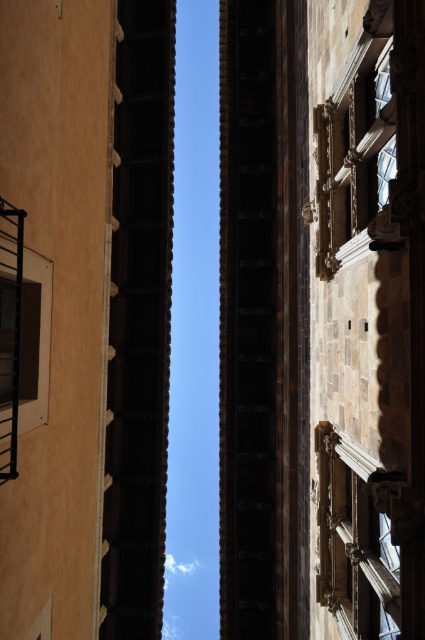
Is polished stone window at lower right wider than polished stone window at upper center?

In fact, polished stone window at lower right might be narrower than polished stone window at upper center.

Between polished stone window at lower right and polished stone window at upper center, which one appears on the right side from the viewer's perspective?

Positioned to the right is polished stone window at upper center.

Consider the image. Who is more forward, (365, 582) or (337, 202)?

Positioned in front is point (365, 582).

Identify the location of polished stone window at lower right. Image resolution: width=425 pixels, height=640 pixels. (357, 538).